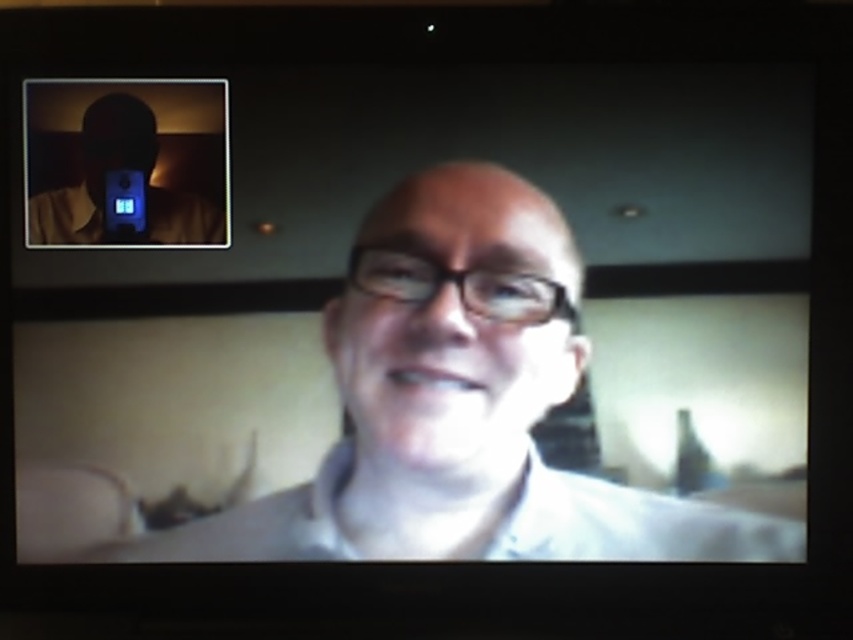
You are trying to determine the order of two points on the screen. Given that you are looking at the image from the front, which point is closer to you, point 1 at coordinates (99, 170) or point 2 at (120, 214)?

Point 1 at coordinates (99, 170) is closer to you because it is in front of point 2 at (120, 214).

You are setting up a video call on your laptop. You want to ensure that the matte black phone at upper left is visible in the frame. Based on its distance from the camera, can you estimate whether it will be in the visible area of the video call frame?

The matte black phone at upper left is 1.16 meters away from the camera. Since typical laptop cameras have a field of view that can capture objects within a few meters, the phone should be within the visible area of the video call frame.

You are setting up a video call and notice two devices at the upper left corner of your screen. The matte black phone at upper left and the blue plastic video camera at upper left. Which device is taller?

The matte black phone at upper left is much taller than the blue plastic video camera at upper left.